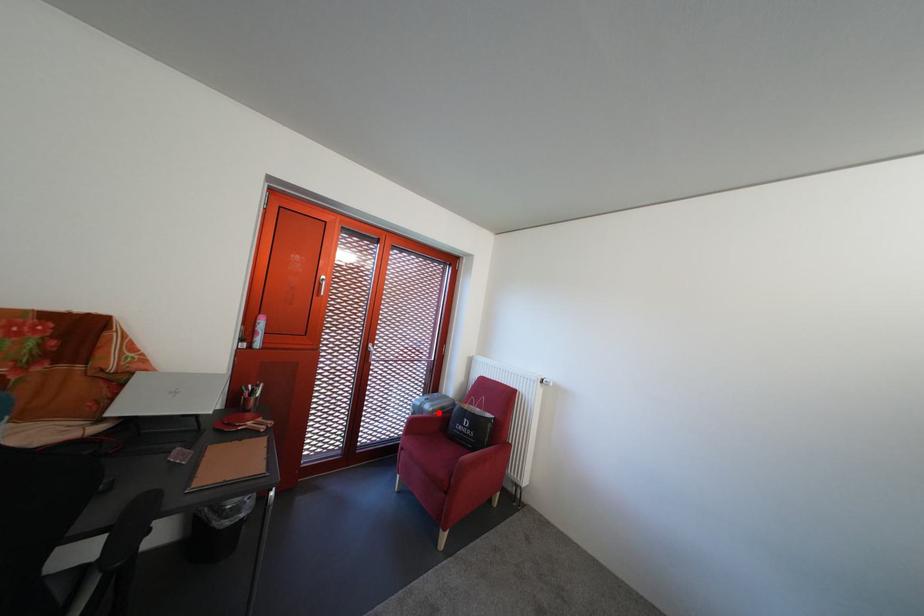
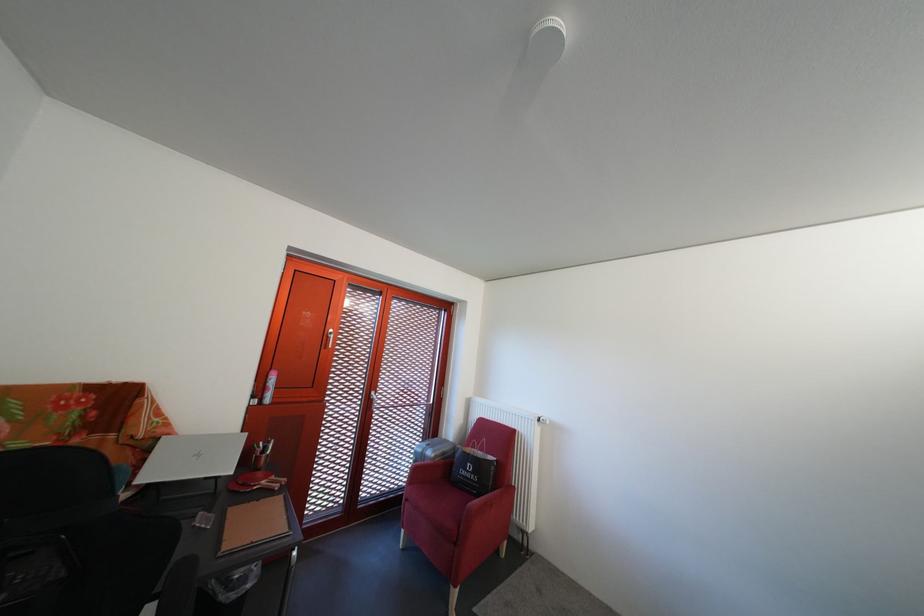
Where in the second image is the point corresponding to the highlighted location from the first image?

(441, 459)